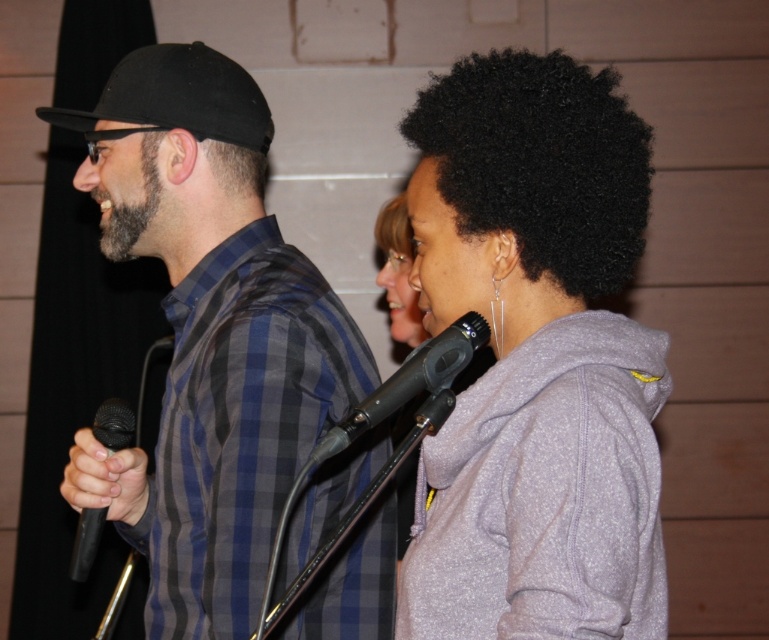
Can you confirm if gray fleece hoodie at center is wider than black matte microphone at left?

Indeed, gray fleece hoodie at center has a greater width compared to black matte microphone at left.

Does gray fleece hoodie at center appear under black matte microphone at left?

No.

Which is behind, point (554, 195) or point (110, 412)?

The point (110, 412) is more distant.

Where is `gray fleece hoodie at center`? gray fleece hoodie at center is located at coordinates (534, 358).

Is black matte microphone at center bigger than black matte microphone at left?

No.

Does black matte microphone at center have a greater width compared to black matte microphone at left?

Yes.

What do you see at coordinates (408, 381) in the screenshot?
I see `black matte microphone at center` at bounding box center [408, 381].

At what (x,y) coordinates should I click in order to perform the action: click on black matte microphone at center. Please return your answer as a coordinate pair (x, y). The height and width of the screenshot is (640, 769). Looking at the image, I should click on (408, 381).

Is the position of plaid shirt at left more distant than that of black matte baseball cap at left?

No, it is in front of black matte baseball cap at left.

Is point (245, 237) farther from viewer compared to point (125, 67)?

No, (245, 237) is closer to viewer.

Is point (345, 316) positioned after point (38, 115)?

No, (345, 316) is in front of (38, 115).

In order to click on plaid shirt at left in this screenshot , I will do `click(208, 336)`.